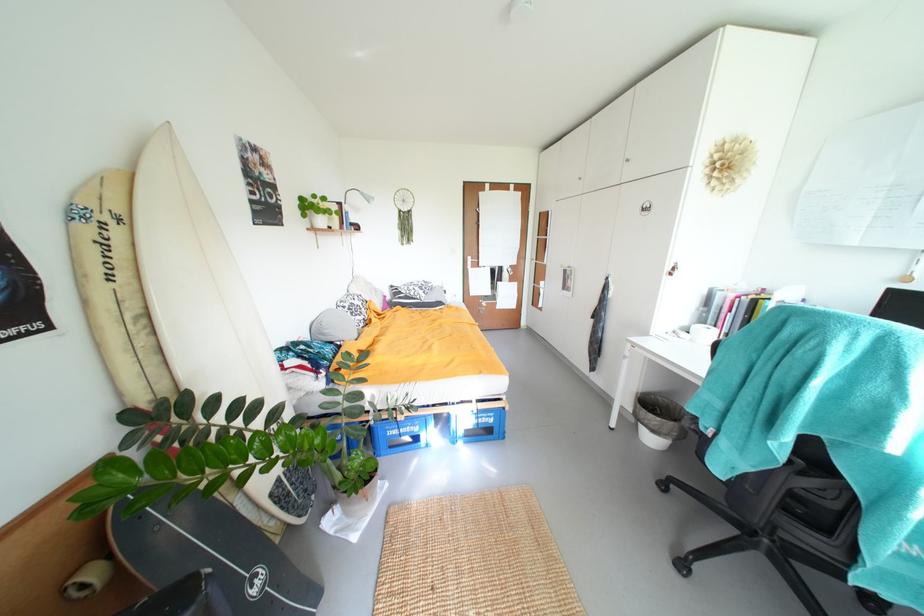
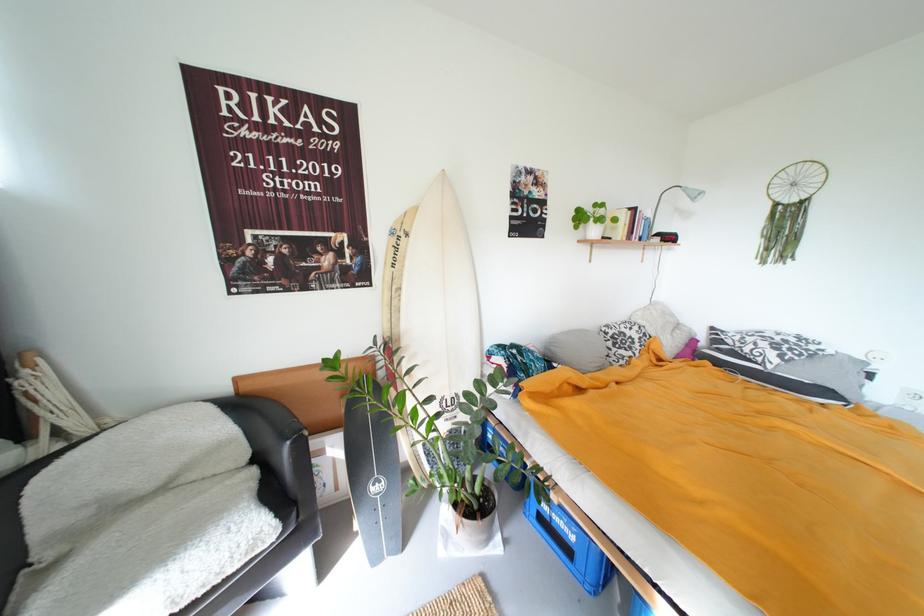
In the second image, find the point that corresponds to the point at 351,309 in the first image.

(614, 334)